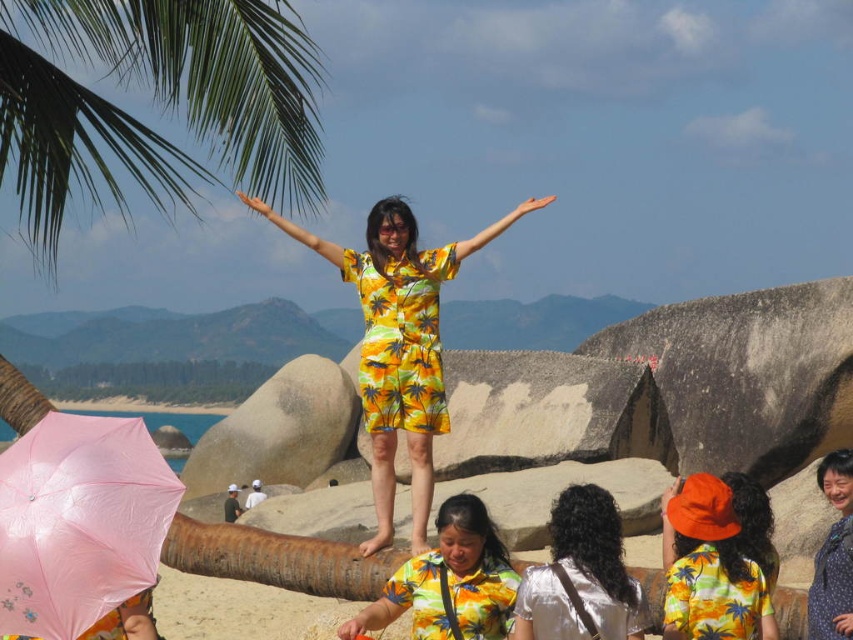
You are a photographer at the beach scene. You need to position a camera so that both the silvery metallic dress at center and the orange cotton hat at center are visible in the frame. Which object should you focus on first to ensure both are in the shot?

The silvery metallic dress at center is below orange cotton hat at center, so you should focus on the orange cotton hat at center first to ensure both are in the frame.

You are a photographer trying to capture the perfect shot of the matte floral dress at center. However, the pink matte umbrella at lower left is casting a shadow over it. Can you adjust your position so that the umbrella no longer blocks the dress?

The pink matte umbrella at lower left is positioned over the matte floral dress at center, so moving to the side or behind the umbrella would allow you to capture the dress without the shadow.

You are a photographer at the beach scene described. You want to capture a photo that includes both the woman on the large curved rock formation and the green leafy palm tree at upper left. Given that the palm tree is at point (155, 100), will you need to adjust your camera angle to include both subjects in the frame?

The green leafy palm tree at upper left is located at point (155, 100). Since the woman is on the large curved rock formation in the foreground and the palm tree is at a specific coordinate, you will need to adjust your camera angle to ensure both are within the frame.